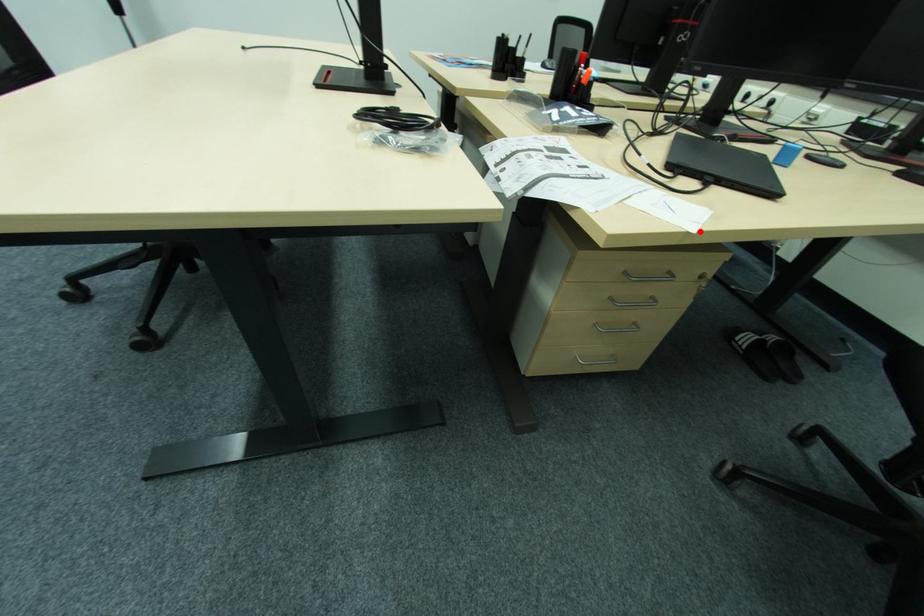
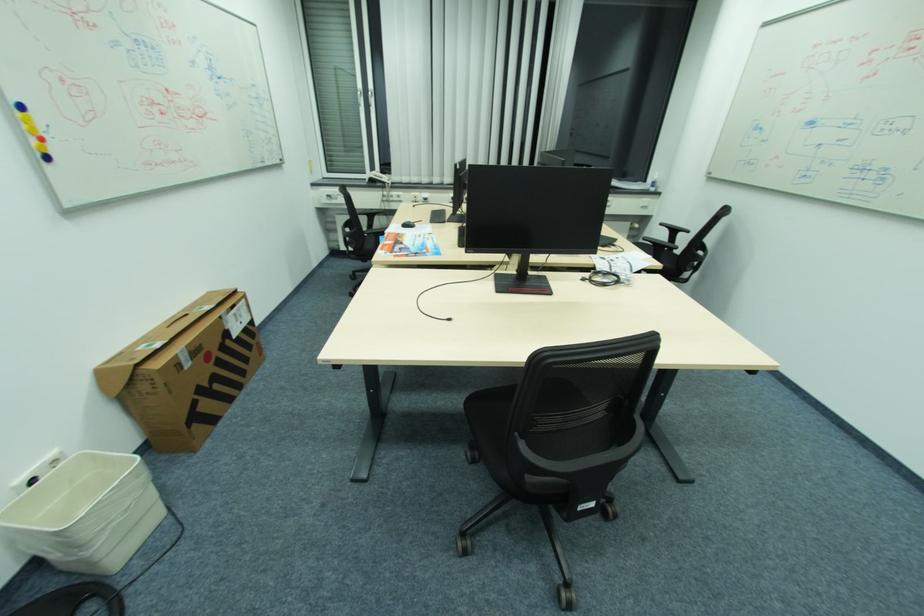
In the second image, find the point that corresponds to the highlighted location in the first image.

(657, 257)